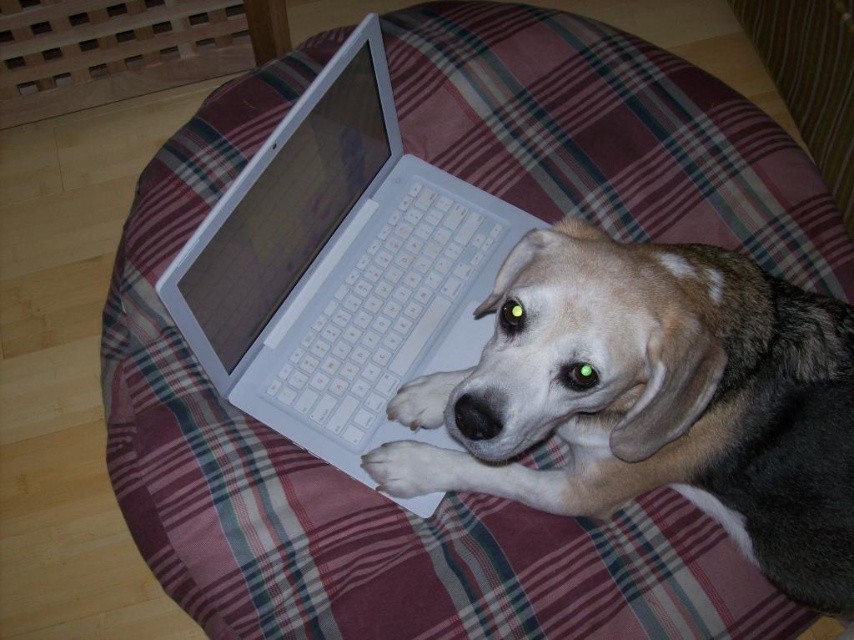
Question: Which point is closer to the camera taking this photo?

Choices:
 (A) (455, 452)
 (B) (300, 300)
 (C) (392, 252)

Answer: (A)

Question: Which point is farther to the camera?

Choices:
 (A) (428, 374)
 (B) (509, 227)
 (C) (556, 358)

Answer: (B)

Question: Is the position of white plastic keyboard at center more distant than that of white soft paw at lower center?

Choices:
 (A) no
 (B) yes

Answer: (B)

Question: Is white plastic keyboard at center above white soft fur paw at center?

Choices:
 (A) no
 (B) yes

Answer: (B)

Question: Is light brown fur at center further to camera compared to white soft paw at lower center?

Choices:
 (A) yes
 (B) no

Answer: (B)

Question: Which is nearer to the light brown fur at center?

Choices:
 (A) white soft paw at lower center
 (B) white soft fur paw at center
 (C) white plastic laptop at center
 (D) white plastic keyboard at center

Answer: (B)